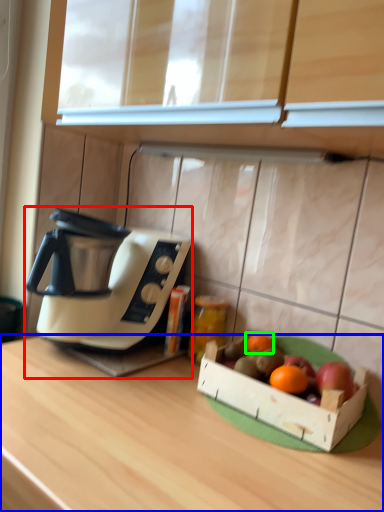
Question: Which is nearer to the coffee maker (highlighted by a red box)? desk (highlighted by a blue box) or grapefruit (highlighted by a green box).

Choices:
 (A) desk
 (B) grapefruit

Answer: (A)